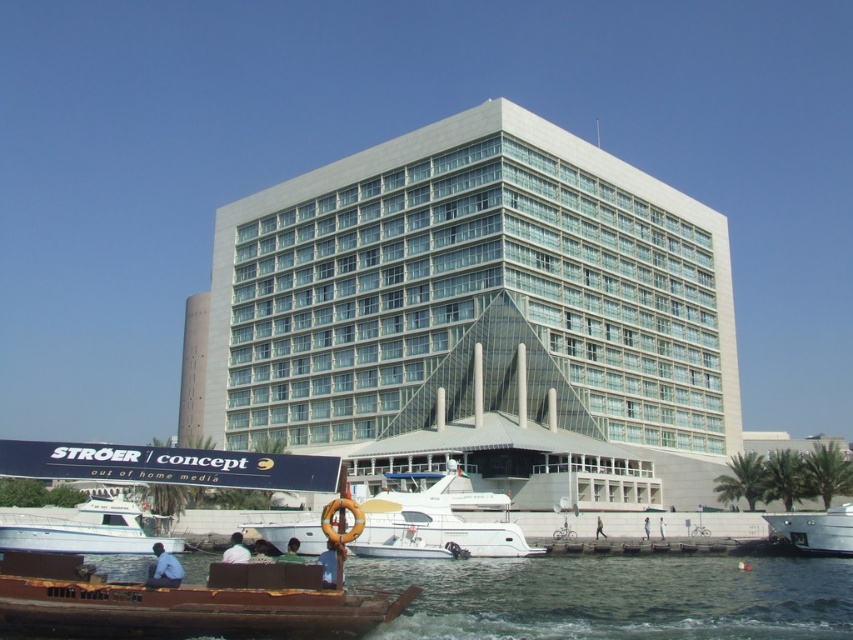
You are a photographer planning to capture the brown wooden boat at lower left and the green fabric shirt at lower center in a single shot. Which object should you focus on first to ensure both are in frame without moving the camera?

You should focus on the brown wooden boat at lower left first because it is larger than the green fabric shirt at lower center, so ensuring it fits properly will naturally include the smaller object in the frame.

You are standing on the dock and see the white glossy boat at center and the metallic silver boat at lower right. Which boat is closer to you?

The white glossy boat at center is closer to you because it is in front of the metallic silver boat at lower right.